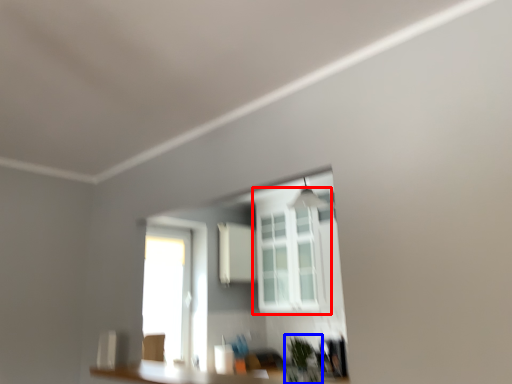
Question: Which of the following is the farthest to the observer, window (highlighted by a red box) or plant (highlighted by a blue box)?

Choices:
 (A) window
 (B) plant

Answer: (A)